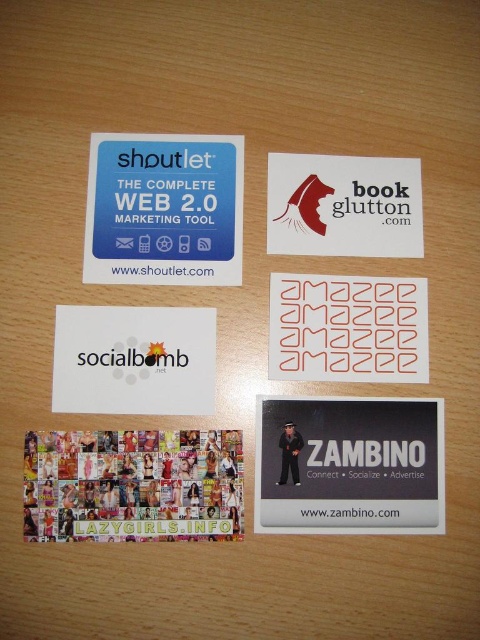
Does black matte postcard at lower right come behind matte plastic business card at upper left?

No, black matte postcard at lower right is closer to the viewer.

Does black matte postcard at lower right appear over matte plastic business card at upper left?

Incorrect, black matte postcard at lower right is not positioned above matte plastic business card at upper left.

Which is behind, point (315, 515) or point (191, 259)?

The point (191, 259) is more distant.

This screenshot has width=480, height=640. What are the coordinates of `black matte postcard at lower right` in the screenshot? It's located at (349, 465).

Measure the distance between white paper at center and white matte business card at upper center.

white paper at center is 8.71 inches from white matte business card at upper center.

Is white paper at center closer to camera compared to white matte business card at upper center?

That is True.

The image size is (480, 640). Find the location of `white paper at center`. white paper at center is located at coordinates (133, 360).

Is point (157, 196) closer to viewer compared to point (361, 376)?

No, (157, 196) is further to viewer.

Is point (205, 168) positioned after point (416, 317)?

Yes, it is behind point (416, 317).

Where is `matte plastic business card at upper left`? The height and width of the screenshot is (640, 480). matte plastic business card at upper left is located at coordinates (164, 209).